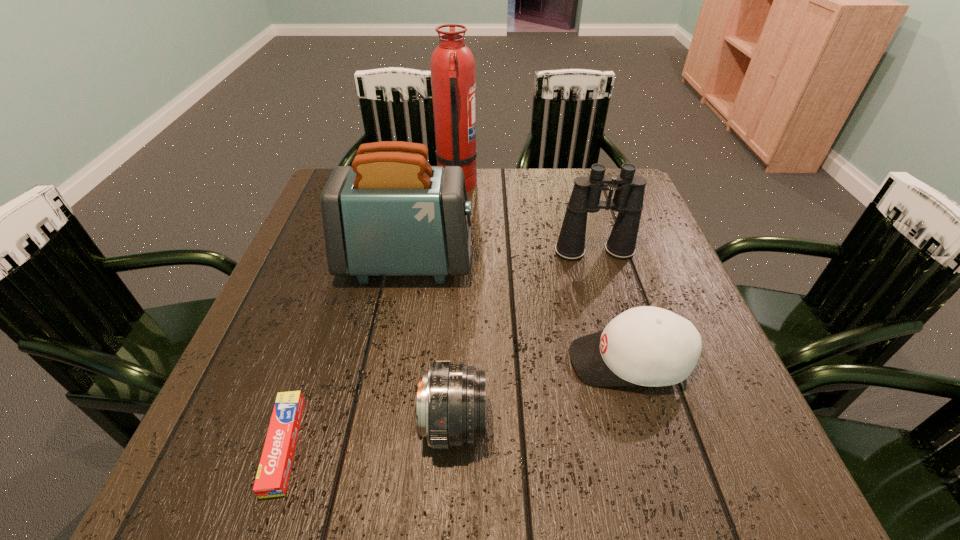
Identify the location of free spot that satisfies the following two spatial constraints: 1. on the label side of the binoculars; 2. on the right side of the tallest object. (452, 252).

What are the coordinates of `vacant space that satisfies the following two spatial constraints: 1. on the label side of the fire extinguisher; 2. on the front side of the toothpaste` in the screenshot? It's located at (439, 445).

The width and height of the screenshot is (960, 540). I want to click on vacant space that satisfies the following two spatial constraints: 1. on the label side of the farthest object; 2. on the front side of the toothpaste, so click(439, 445).